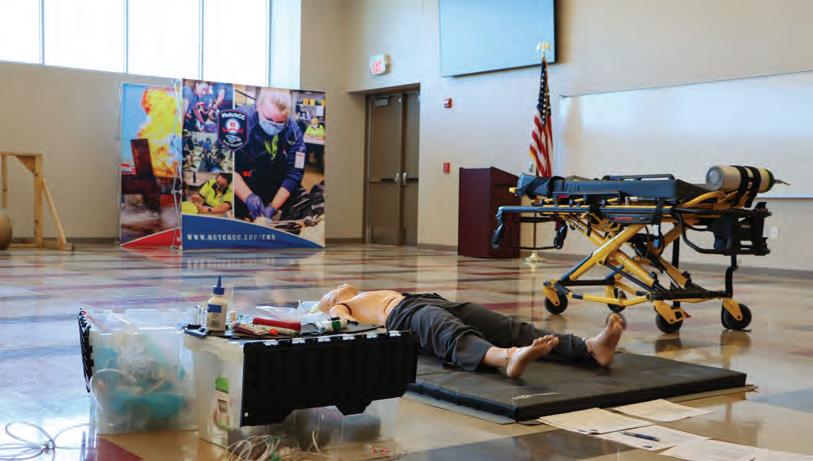
Where is `floor`? The width and height of the screenshot is (813, 461). floor is located at coordinates (500, 442).